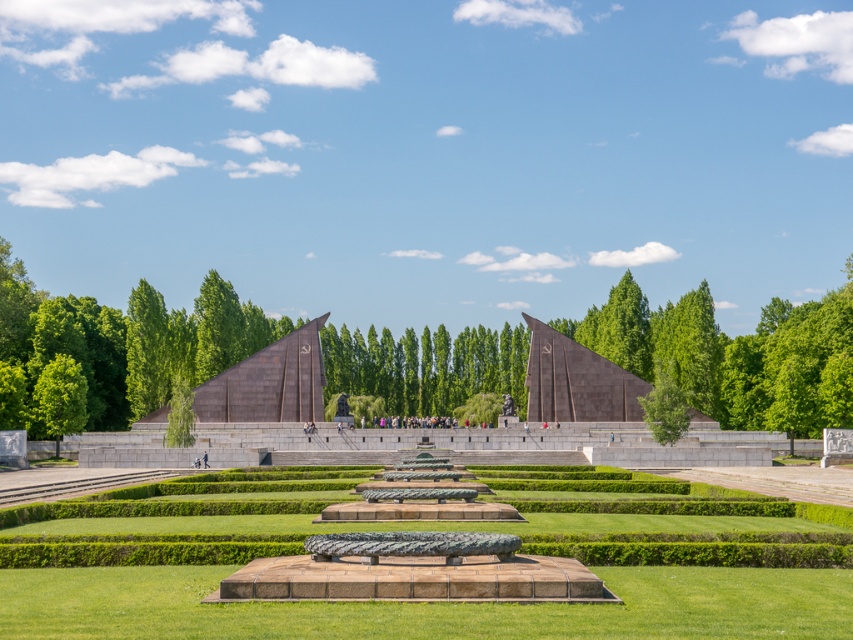
You are standing in the park and want to take a photo of the green leafy tree at center. If your camera can focus on objects up to 120 meters away, will you be able to take a clear photo of the tree?

The green leafy tree at center is 130.28 meters from viewer. Since the camera can only focus up to 120 meters, you will not be able to take a clear photo of the tree.